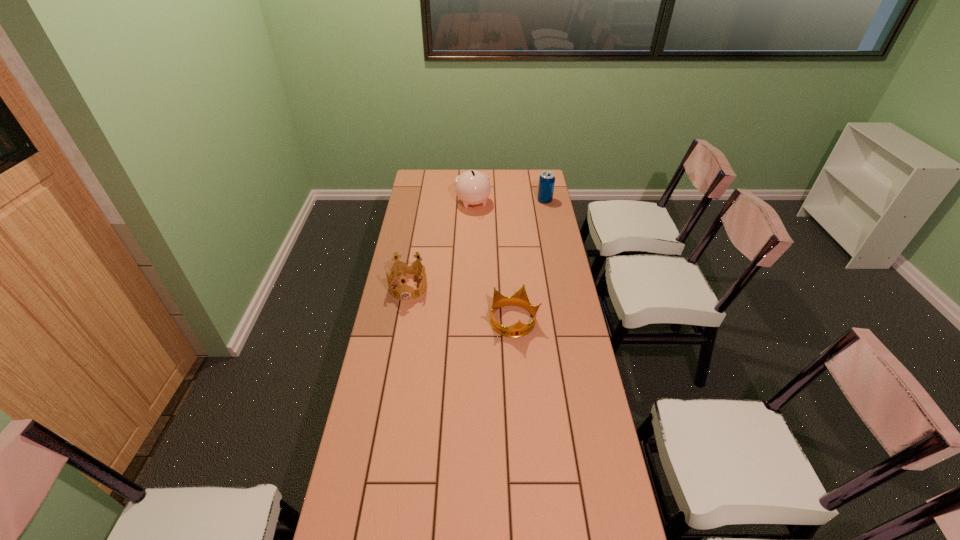
I want to click on unoccupied position between the rightmost object and the leftmost object, so click(476, 244).

At what (x,y) coordinates should I click in order to perform the action: click on vacant area that lies between the shortest object and the pop soda. Please return your answer as a coordinate pair (x, y). Image resolution: width=960 pixels, height=540 pixels. Looking at the image, I should click on (529, 261).

Locate an element on the screen. The width and height of the screenshot is (960, 540). the third closest object to the piggy bank is located at coordinates (519, 329).

Identify which object is the nearest to the piggy bank. Please provide its 2D coordinates. Your answer should be formatted as a tuple, i.e. [(x, y)], where the tuple contains the x and y coordinates of a point satisfying the conditions above.

[(547, 179)]

Choose which crown is the second nearest neighbor to the piggy bank. Please provide its 2D coordinates. Your answer should be formatted as a tuple, i.e. [(x, y)], where the tuple contains the x and y coordinates of a point satisfying the conditions above.

[(519, 329)]

This screenshot has width=960, height=540. Identify the location of free spot that satisfies the following two spatial constraints: 1. on the front side of the taller crown; 2. on the right side of the shorter crown. (402, 322).

Where is `vacant space that satisfies the following two spatial constraints: 1. on the back side of the pop soda; 2. on the right side of the second nearest object`? vacant space that satisfies the following two spatial constraints: 1. on the back side of the pop soda; 2. on the right side of the second nearest object is located at coordinates (423, 200).